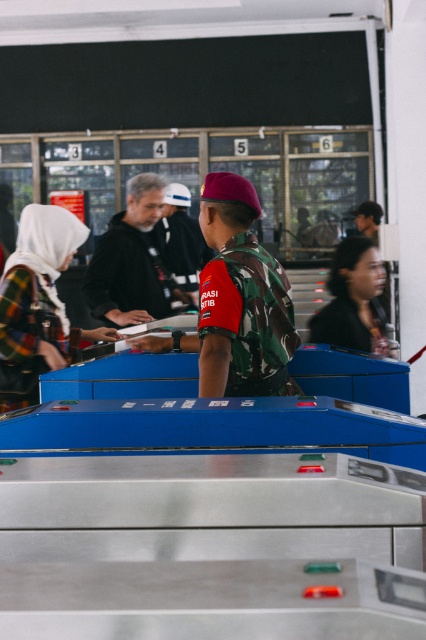
Question: Considering the real-world distances, which object is farthest from the dark gray hoodie at center?

Choices:
 (A) camouflage uniform at center
 (B) dark brown hair at center
 (C) plaid fabric hijab at left

Answer: (B)

Question: Which object is the closest to the dark gray hoodie at center?

Choices:
 (A) camouflage uniform at center
 (B) dark brown hair at center

Answer: (A)

Question: Is dark gray hoodie at center further to camera compared to camouflage uniform at center?

Choices:
 (A) no
 (B) yes

Answer: (A)

Question: Does plaid fabric hijab at left appear over dark gray hoodie at center?

Choices:
 (A) yes
 (B) no

Answer: (B)

Question: Among these points, which one is nearest to the camera?

Choices:
 (A) (163, 211)
 (B) (132, 228)

Answer: (B)

Question: Is dark gray hoodie at center thinner than camouflage uniform at center?

Choices:
 (A) no
 (B) yes

Answer: (A)